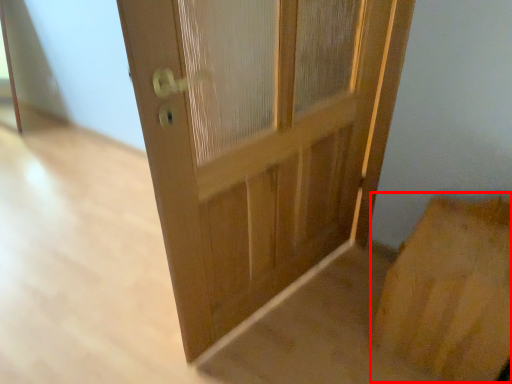
Question: From the image, what is the correct spatial relationship of cardboard box (annotated by the red box) in relation to door?

Choices:
 (A) right
 (B) left

Answer: (A)